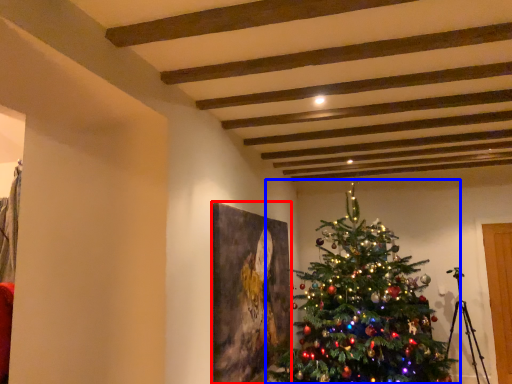
Question: Which object appears closest to the camera in this image, picture frame (highlighted by a red box) or christmas tree (highlighted by a blue box)?

Choices:
 (A) picture frame
 (B) christmas tree

Answer: (B)